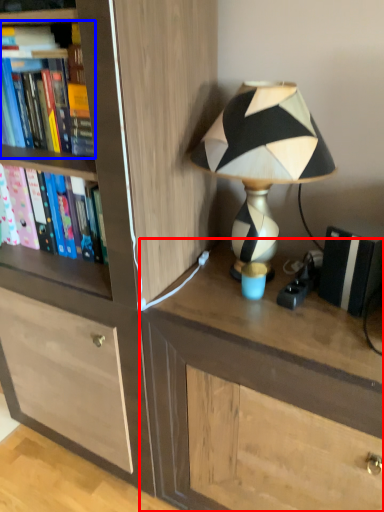
Question: Which object is further to the camera taking this photo, desk (highlighted by a red box) or book (highlighted by a blue box)?

Choices:
 (A) desk
 (B) book

Answer: (B)